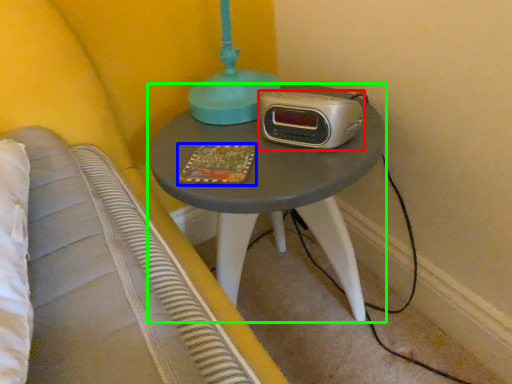
Question: Based on their relative distances, which object is nearer to stereo (highlighted by a red box)? Choose from book (highlighted by a blue box) and nightstand (highlighted by a green box).

Choices:
 (A) book
 (B) nightstand

Answer: (A)